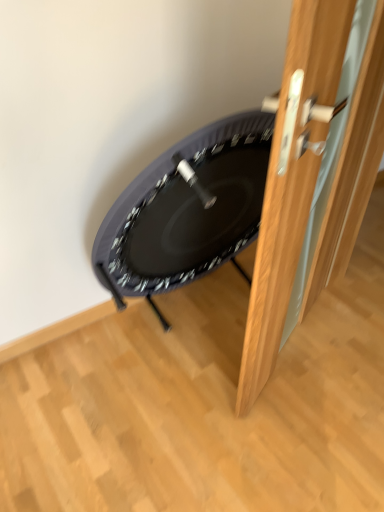
This screenshot has width=384, height=512. In order to click on vacant space to the right of wooden door at right in this screenshot , I will do `click(344, 345)`.